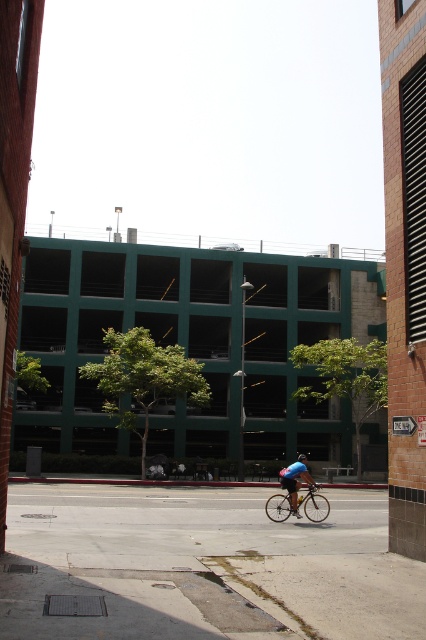
Is gray concrete pavement at center behind blue matte bicycle helmet at center?

No, gray concrete pavement at center is in front of blue matte bicycle helmet at center.

Which is in front, point (169, 508) or point (305, 454)?

Point (169, 508) is more forward.

Identify the location of gray concrete pavement at center. This screenshot has width=426, height=640. (204, 564).

Who is higher up, shiny silver bicycle at center or blue fabric cyclist at center?

shiny silver bicycle at center

Between shiny silver bicycle at center and blue fabric cyclist at center, which one has more height?

blue fabric cyclist at center

The height and width of the screenshot is (640, 426). Describe the element at coordinates (313, 504) in the screenshot. I see `shiny silver bicycle at center` at that location.

Where is `shiny silver bicycle at center`? Image resolution: width=426 pixels, height=640 pixels. shiny silver bicycle at center is located at coordinates (313, 504).

Is gray concrete pavement at center below blue fabric cyclist at center?

No.

From the picture: Who is taller, gray concrete pavement at center or blue fabric cyclist at center?

With more height is blue fabric cyclist at center.

Does point (287, 540) come closer to viewer compared to point (293, 481)?

Yes, it is in front of point (293, 481).

You are a GUI agent. You are given a task and a screenshot of the screen. Output one action in this format:
    pyautogui.click(x=<x>, y=<y>)
    Task: Click on the gray concrete pavement at center
    The image size is (426, 640).
    Given the screenshot: What is the action you would take?
    pyautogui.click(x=204, y=564)